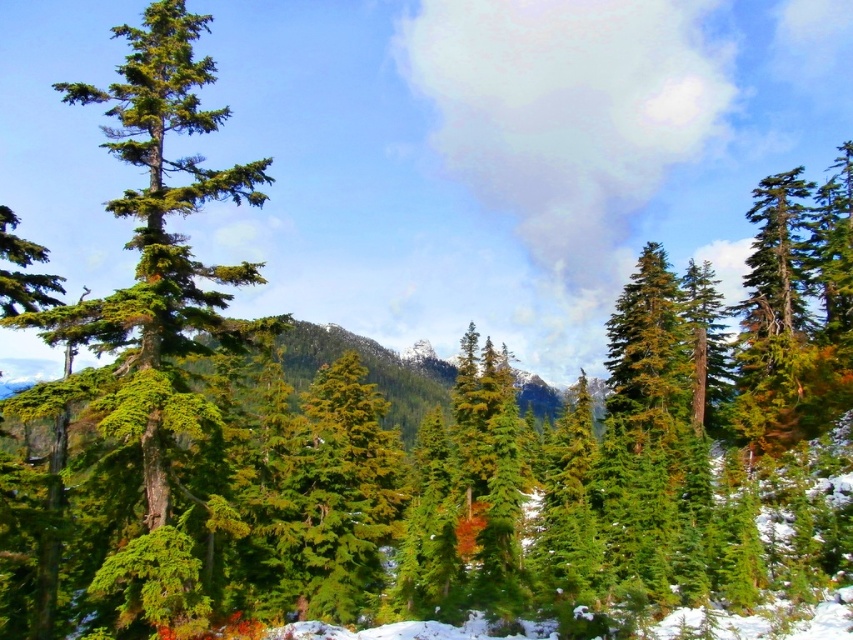
Question: Does green textured evergreen tree at left come in front of green matte tree at center?

Choices:
 (A) yes
 (B) no

Answer: (A)

Question: Is green textured evergreen tree at left below green matte tree at center?

Choices:
 (A) yes
 (B) no

Answer: (B)

Question: Does green textured evergreen tree at left appear on the left side of green matte tree at center?

Choices:
 (A) yes
 (B) no

Answer: (A)